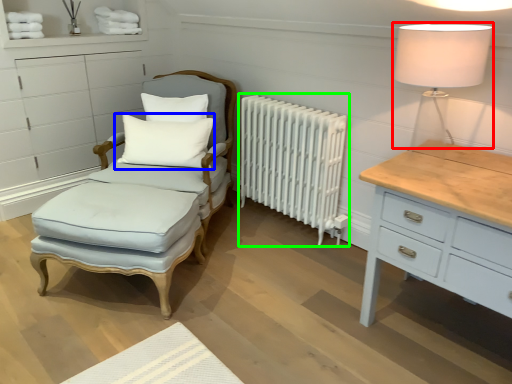
Question: Considering the real-world distances, which object is farthest from table lamp (highlighted by a red box)? pillow (highlighted by a blue box) or radiator (highlighted by a green box)?

Choices:
 (A) pillow
 (B) radiator

Answer: (A)